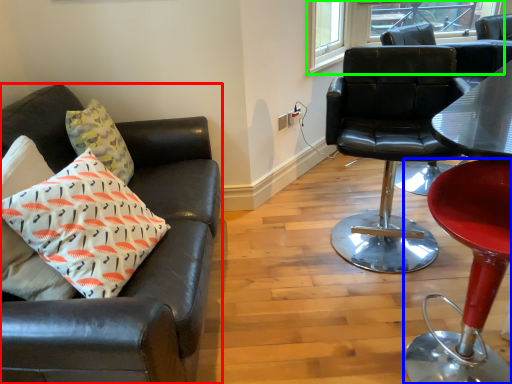
Question: Considering the real-world distances, which object is closest to chair (highlighted by a red box)? chair (highlighted by a blue box) or window (highlighted by a green box).

Choices:
 (A) chair
 (B) window

Answer: (A)